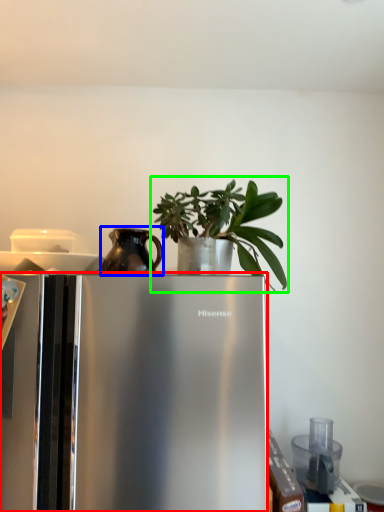
Question: Considering the real-world distances, which object is closest to refrigerator (highlighted by a red box)? jug (highlighted by a blue box) or houseplant (highlighted by a green box).

Choices:
 (A) jug
 (B) houseplant

Answer: (A)